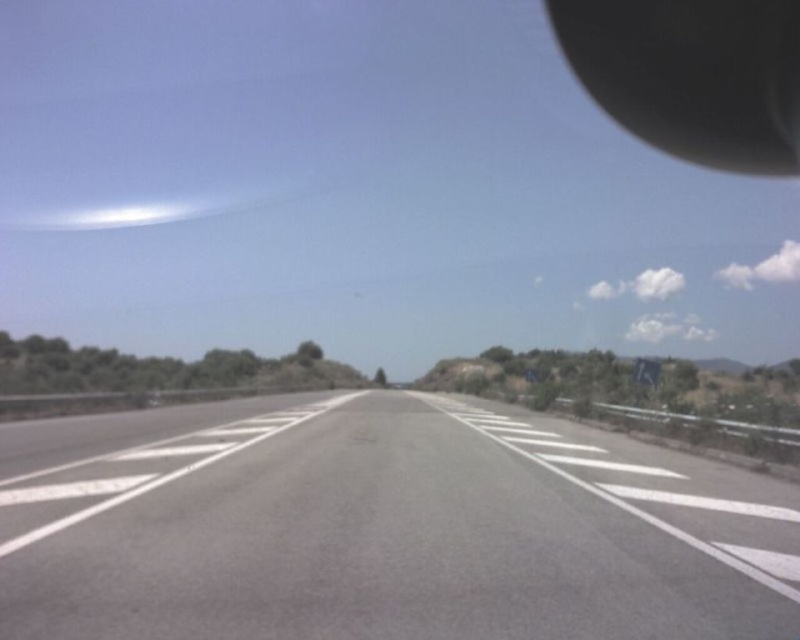
Is gray asphalt highway at center wider than black rubber rearview mirror at upper right?

In fact, gray asphalt highway at center might be narrower than black rubber rearview mirror at upper right.

Which is more to the right, gray asphalt highway at center or black rubber rearview mirror at upper right?

black rubber rearview mirror at upper right is more to the right.

Between point (388, 432) and point (678, 29), which one is positioned in front?

Point (388, 432)

The height and width of the screenshot is (640, 800). I want to click on gray asphalt highway at center, so click(x=382, y=528).